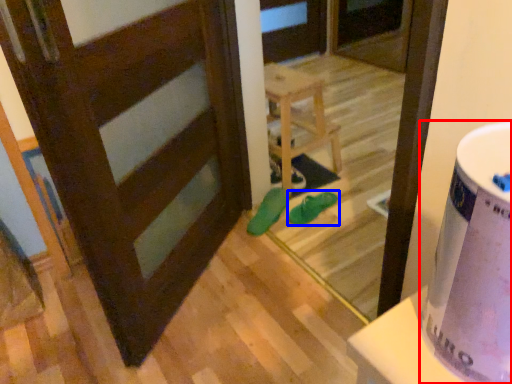
Question: Which object is closer to the camera taking this photo, potty (highlighted by a red box) or footwear (highlighted by a blue box)?

Choices:
 (A) potty
 (B) footwear

Answer: (A)